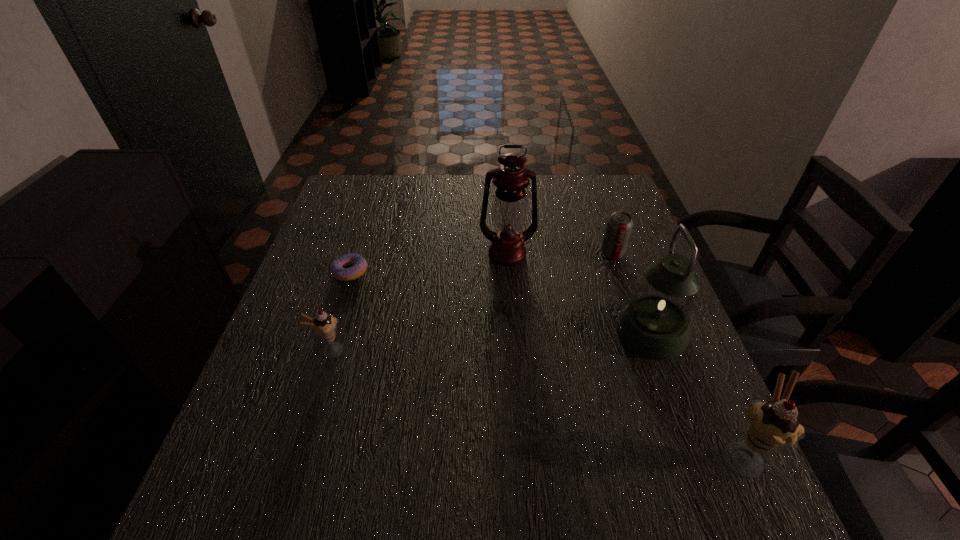
Where is `vacant area that lies between the doughnut and the taller icecream`? vacant area that lies between the doughnut and the taller icecream is located at coordinates (545, 363).

Locate an element on the screen. The height and width of the screenshot is (540, 960). vacant space that's between the fifth shortest object and the oil lamp is located at coordinates (579, 293).

What are the coordinates of `free space between the taller icecream and the third object from left to right` in the screenshot? It's located at (624, 354).

The height and width of the screenshot is (540, 960). I want to click on empty space that is in between the shortest object and the fourth object from right to left, so click(x=429, y=263).

This screenshot has height=540, width=960. Identify the location of free space between the oil lamp and the shortest object. (429, 263).

Identify the location of vacant space in between the third tallest object and the doughnut. The height and width of the screenshot is (540, 960). 545,363.

The height and width of the screenshot is (540, 960). Find the location of `object that ranks as the fifth closest to the oil lamp`. object that ranks as the fifth closest to the oil lamp is located at coordinates coord(772,425).

Where is `object that stands as the second closest to the shortest object`? Image resolution: width=960 pixels, height=540 pixels. object that stands as the second closest to the shortest object is located at coordinates (509, 209).

This screenshot has width=960, height=540. Find the location of `free region that satisfies the following two spatial constraints: 1. on the back side of the third object from left to right; 2. on the left side of the shortest object`. free region that satisfies the following two spatial constraints: 1. on the back side of the third object from left to right; 2. on the left side of the shortest object is located at coordinates (356, 254).

What are the coordinates of `free space in the image that satisfies the following two spatial constraints: 1. on the front side of the shorter icecream; 2. on the left side of the third tallest object` in the screenshot? It's located at (299, 454).